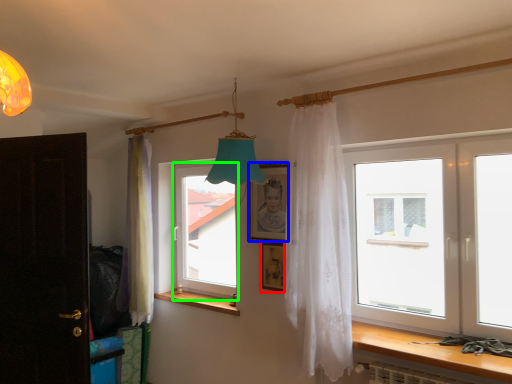
Question: Considering the real-world distances, which object is farthest from picture frame (highlighted by a red box)? picture frame (highlighted by a blue box) or window (highlighted by a green box)?

Choices:
 (A) picture frame
 (B) window

Answer: (B)